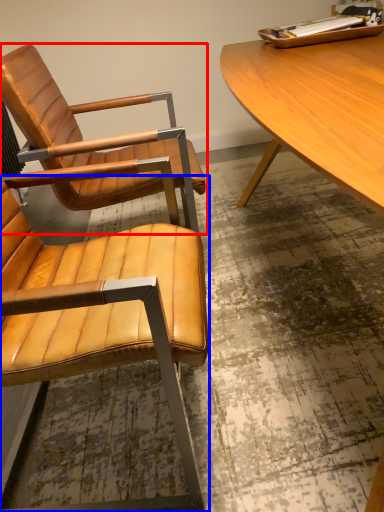
Question: Which of the following is the closest to the observer, chair (highlighted by a red box) or chair (highlighted by a blue box)?

Choices:
 (A) chair
 (B) chair

Answer: (B)